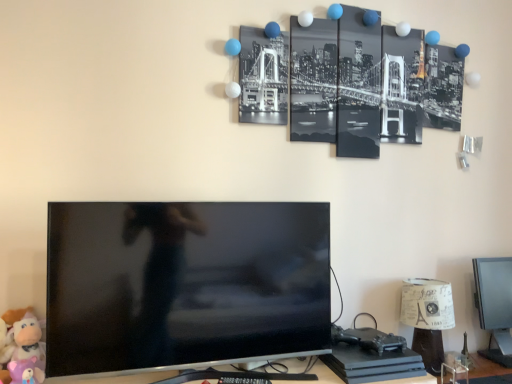
Question: Can you confirm if black glossy tv at center is positioned to the right of matte black monitor at lower right?

Choices:
 (A) no
 (B) yes

Answer: (A)

Question: Does black glossy tv at center appear on the left side of matte black monitor at lower right?

Choices:
 (A) yes
 (B) no

Answer: (A)

Question: Considering the relative sizes of black glossy tv at center and matte black monitor at lower right in the image provided, is black glossy tv at center smaller than matte black monitor at lower right?

Choices:
 (A) yes
 (B) no

Answer: (B)

Question: Is black glossy tv at center closer to camera compared to matte black monitor at lower right?

Choices:
 (A) no
 (B) yes

Answer: (B)

Question: Can you confirm if black glossy tv at center is bigger than matte black monitor at lower right?

Choices:
 (A) yes
 (B) no

Answer: (A)

Question: Is black glossy tv at center aimed at matte black monitor at lower right?

Choices:
 (A) yes
 (B) no

Answer: (B)

Question: Is matte black monitor at lower right at the back of paper lampshade at lower right?

Choices:
 (A) no
 (B) yes

Answer: (A)

Question: Can you confirm if paper lampshade at lower right is shorter than matte black monitor at lower right?

Choices:
 (A) yes
 (B) no

Answer: (A)

Question: Is paper lampshade at lower right placed right next to matte black monitor at lower right?

Choices:
 (A) yes
 (B) no

Answer: (B)

Question: Can you confirm if paper lampshade at lower right is wider than matte black monitor at lower right?

Choices:
 (A) yes
 (B) no

Answer: (A)

Question: Is paper lampshade at lower right bigger than matte black monitor at lower right?

Choices:
 (A) yes
 (B) no

Answer: (B)

Question: Considering the relative sizes of paper lampshade at lower right and matte black monitor at lower right in the image provided, is paper lampshade at lower right taller than matte black monitor at lower right?

Choices:
 (A) yes
 (B) no

Answer: (B)

Question: Is black glossy tv at center facing away from soft plush toy at lower left, placed as the second toy when sorted from front to back?

Choices:
 (A) yes
 (B) no

Answer: (B)